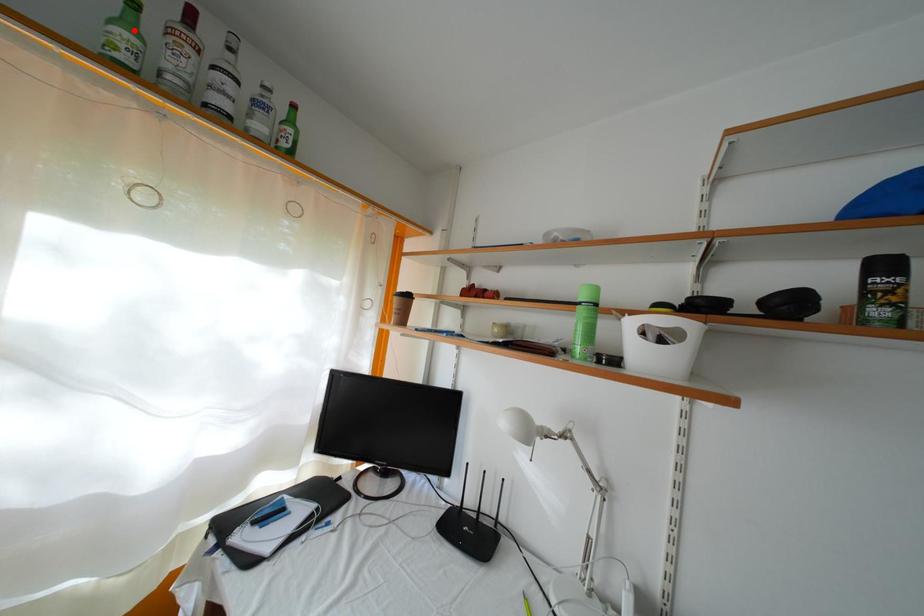
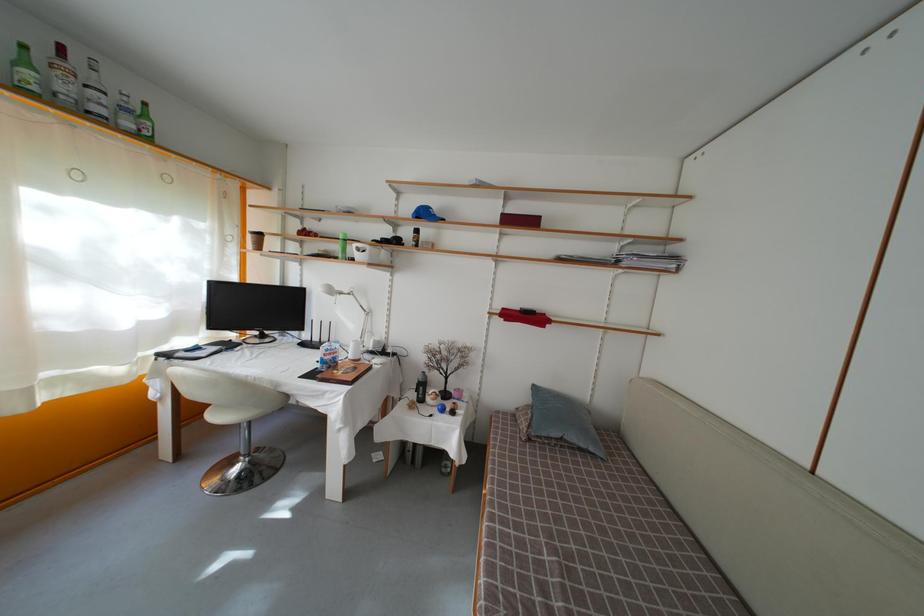
Locate, in the second image, the point that corresponds to the highlighted location in the first image.

(31, 69)